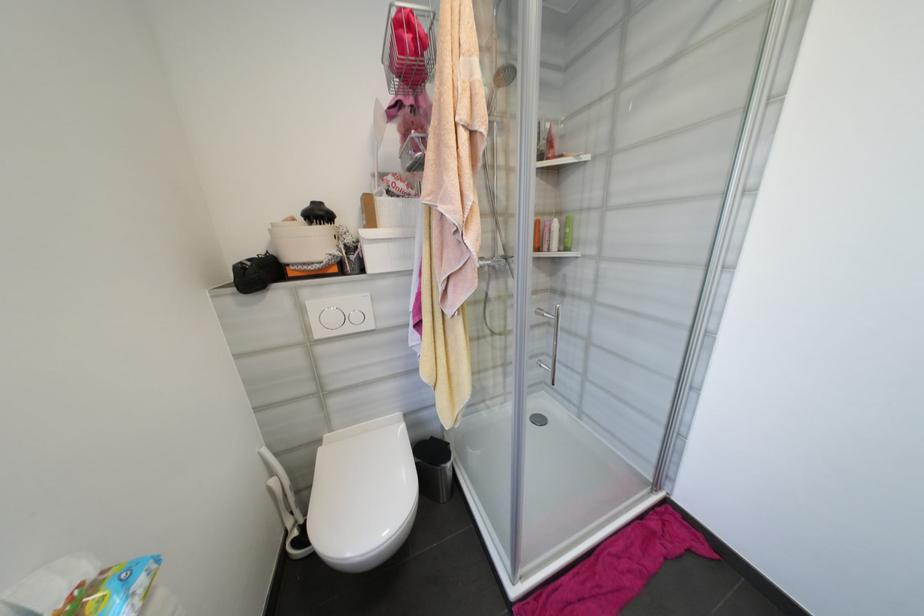
Describe the element at coordinates (277, 488) in the screenshot. I see `the toilet brush handle` at that location.